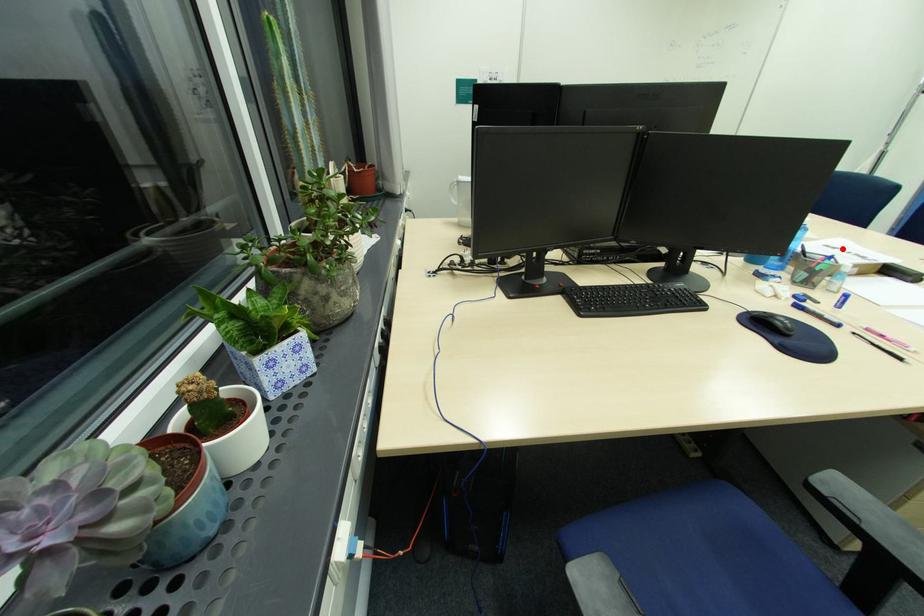
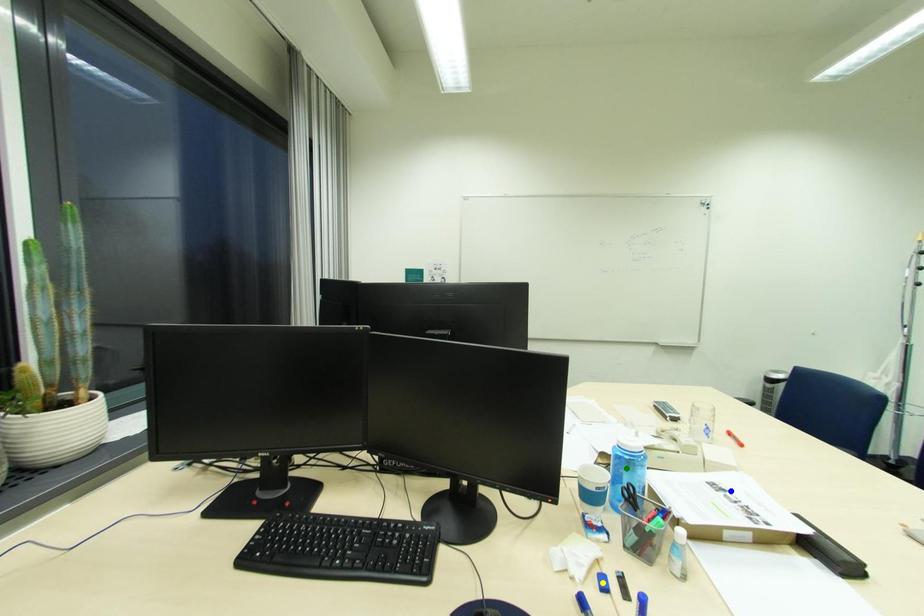
Question: I am providing you with two images of the same scene from different viewpoints. A red point is marked on the first image. You are given multiple points on the second image. Which point in image 2 represents the same 3d spot as the red point in image 1?

Choices:
 (A) blue point
 (B) green point
 (C) yellow point

Answer: (A)